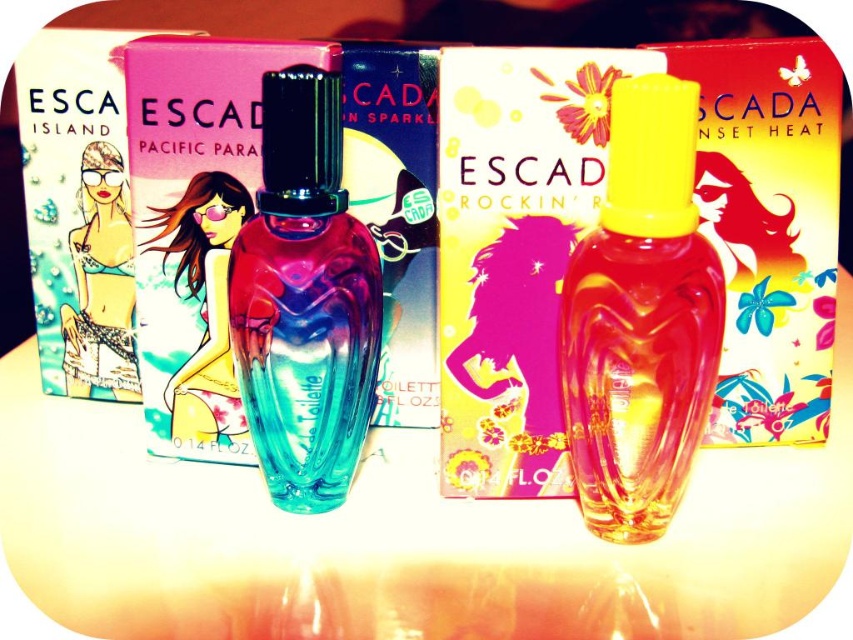
Question: Can you confirm if translucent yellow glass perfume at center is positioned to the right of pink fabric bikini at center?

Choices:
 (A) yes
 (B) no

Answer: (A)

Question: Does pink fabric bikini at center have a smaller size compared to matte silver bikini at center?

Choices:
 (A) no
 (B) yes

Answer: (A)

Question: Can you confirm if translucent yellow glass perfume at center is positioned to the left of matte silver bikini at center?

Choices:
 (A) yes
 (B) no

Answer: (B)

Question: Which object is farther from the camera taking this photo?

Choices:
 (A) pink fabric bikini at center
 (B) translucent yellow glass perfume at center

Answer: (A)

Question: Which is farther from the transparent glass perfume bottles at center?

Choices:
 (A) pink fabric bikini at center
 (B) translucent yellow glass perfume at center
 (C) matte silver bikini at center
 (D) translucent glass perfume at center

Answer: (C)

Question: Which point appears closest to the camera in this image?

Choices:
 (A) (570, 536)
 (B) (582, 365)
 (C) (122, 250)

Answer: (B)